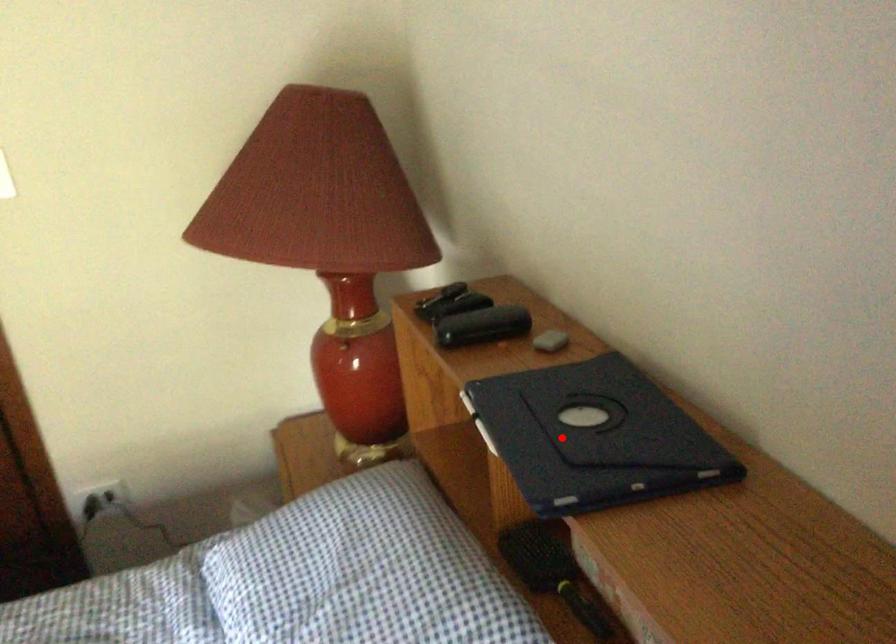
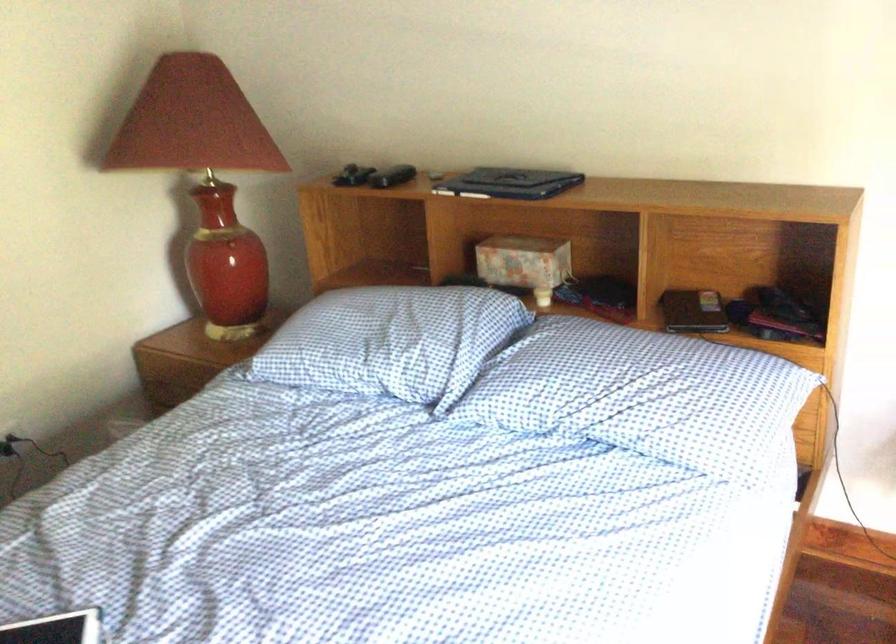
Question: I am providing you with two images of the same scene from different viewpoints. In image1, a red point is highlighted. Considering the same 3D point in image2, which of the following is correct?

Choices:
 (A) It is closer
 (B) It is farther

Answer: (B)